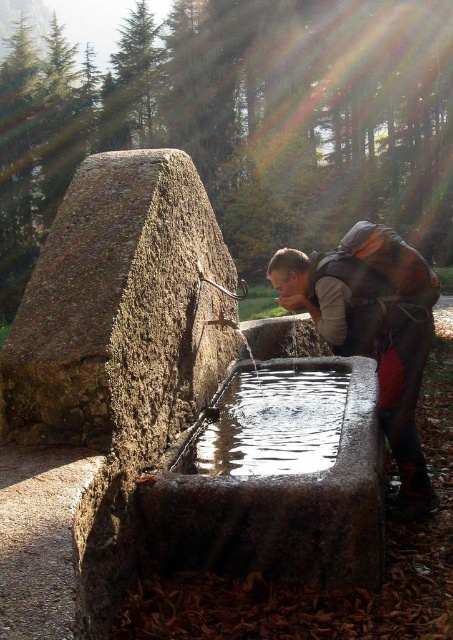
Measure the distance between rough textured stone at center and camera.

rough textured stone at center and camera are 4.07 meters apart from each other.

Which of these two, rough textured stone at center or clear glass water at center, stands shorter?

With less height is rough textured stone at center.

This screenshot has width=453, height=640. Identify the location of rough textured stone at center. (119, 308).

Locate an element on the screen. This screenshot has height=640, width=453. rough textured stone at center is located at coordinates [x=119, y=308].

Does rough textured stone at center appear over granite water trough at center?

→ Correct, rough textured stone at center is located above granite water trough at center.

Can you confirm if rough textured stone at center is wider than granite water trough at center?

No, rough textured stone at center is not wider than granite water trough at center.

At what (x,y) coordinates should I click in order to perform the action: click on rough textured stone at center. Please return your answer as a coordinate pair (x, y). The width and height of the screenshot is (453, 640). Looking at the image, I should click on (119, 308).

Does rough textured stone at center have a larger size compared to matte gray backpack at lower right?

No, rough textured stone at center is not bigger than matte gray backpack at lower right.

Can you confirm if rough textured stone at center is positioned below matte gray backpack at lower right?

Incorrect, rough textured stone at center is not positioned below matte gray backpack at lower right.

This screenshot has height=640, width=453. What do you see at coordinates (119, 308) in the screenshot?
I see `rough textured stone at center` at bounding box center [119, 308].

At what (x,y) coordinates should I click in order to perform the action: click on rough textured stone at center. Please return your answer as a coordinate pair (x, y). Looking at the image, I should click on (119, 308).